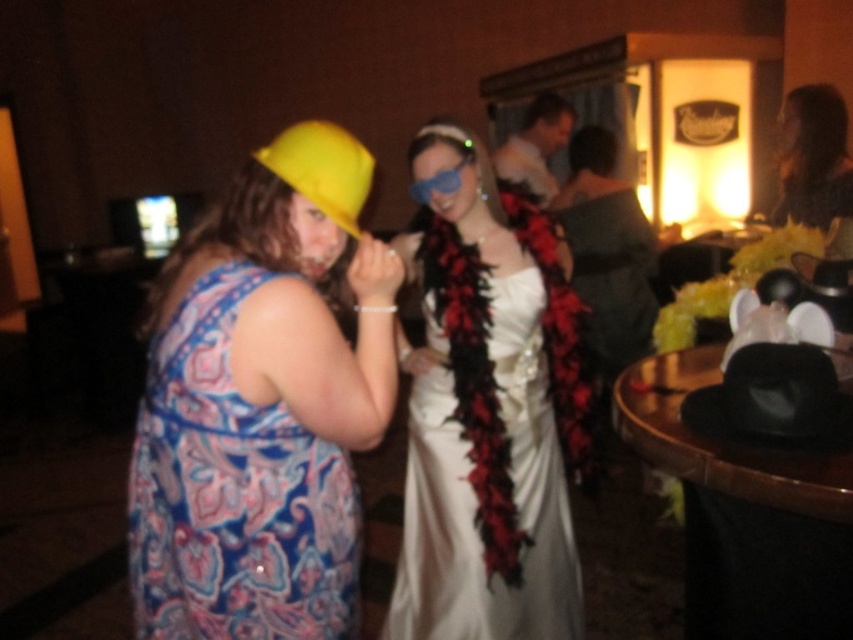
Question: Does matte yellow hat at left appear under yellow fabric hat at upper left?

Choices:
 (A) no
 (B) yes

Answer: (B)

Question: Which of the following is the farthest from the observer?

Choices:
 (A) white satin dress at center
 (B) matte yellow hat at left
 (C) smooth black dress at upper right

Answer: (C)

Question: Based on their relative distances, which object is nearer to the matte gray shirt at upper center?

Choices:
 (A) matte yellow hat at left
 (B) white satin dress at center
 (C) blue matte goggles at center
 (D) smooth black dress at upper right

Answer: (D)

Question: Among these objects, which one is nearest to the camera?

Choices:
 (A) blue matte goggles at center
 (B) yellow fabric hat at upper left
 (C) matte yellow hat at left
 (D) smooth black dress at upper right

Answer: (C)

Question: Does yellow fabric hat at upper left appear on the left side of blue matte goggles at center?

Choices:
 (A) yes
 (B) no

Answer: (A)

Question: Does matte yellow hat at left have a larger size compared to blue matte goggles at center?

Choices:
 (A) yes
 (B) no

Answer: (A)